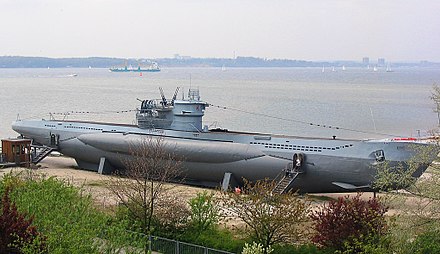
Where is `bottom right corner empty space`? bottom right corner empty space is located at coordinates click(436, 251).